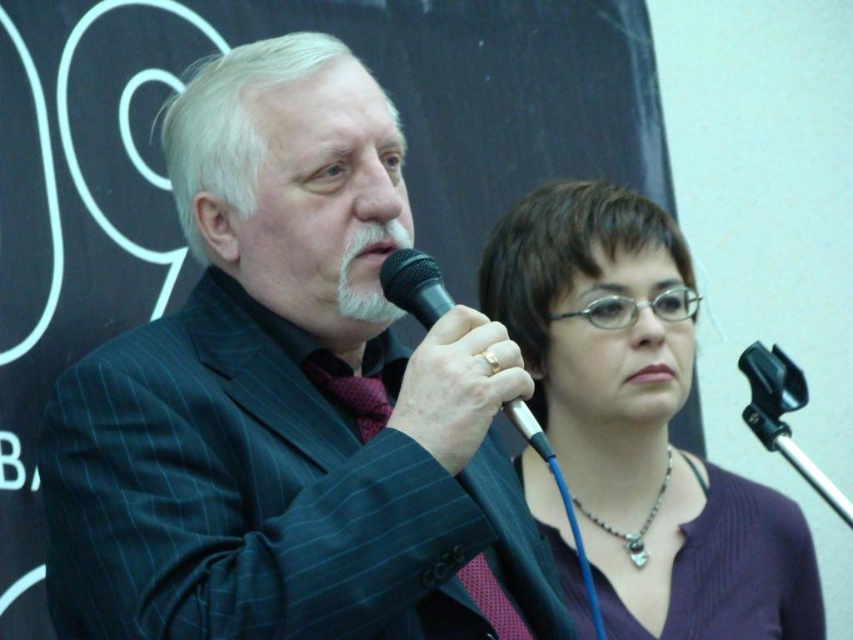
You are standing in the formal event setting and want to move from the point at coordinates point (360, 150) to the point at coordinates point (389, 269). Which direction should you move?

To move from point (360, 150) to point (389, 269), you should move forward since point (360, 150) is behind point (389, 269).

You are a photographer at the event and need to position a spotlight exactly at the center of the purple knitwear at center. Given the coordinate system where the bottom left corner is the origin, can you confirm the exact coordinates where you should place the spotlight?

The exact coordinates for the purple knitwear at center are at point (640, 422), so the spotlight should be placed there.

You are an event planner trying to place a decorative stand between the two individuals in the image. The stand must be placed exactly halfway between the black pinstripe suit at center and the person on the right. What are the coordinates where you should place the stand?

The coordinates for placing the decorative stand would be halfway between the black pinstripe suit at center at point (289, 401) and the person on the right. Since the person on the right is not specified with coordinates, we cannot calculate the exact midpoint. Please provide the coordinates of the person on the right to determine the correct placement.